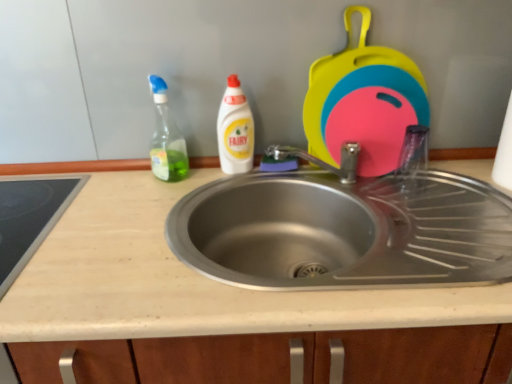
Find the location of a particular element. The width and height of the screenshot is (512, 384). free space in front of white glossy bottle at center, which appears as the first cleaning product when viewed from the right is located at coordinates (204, 195).